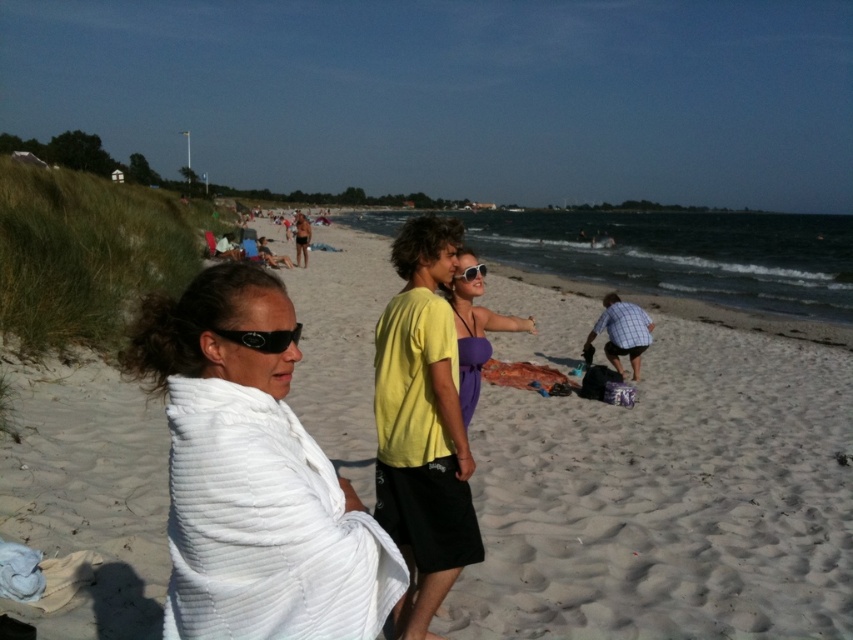
Does yellow cotton t-shirt at center have a larger size compared to matte yellow shirt at center?

Actually, yellow cotton t-shirt at center might be smaller than matte yellow shirt at center.

In the scene shown: Can you confirm if yellow cotton t-shirt at center is positioned to the right of matte yellow shirt at center?

Correct, you'll find yellow cotton t-shirt at center to the right of matte yellow shirt at center.

Between point (392, 380) and point (294, 241), which one is positioned in front?

Point (392, 380)

Image resolution: width=853 pixels, height=640 pixels. I want to click on yellow cotton t-shirt at center, so click(422, 426).

The height and width of the screenshot is (640, 853). I want to click on yellow cotton t-shirt at center, so click(x=422, y=426).

Image resolution: width=853 pixels, height=640 pixels. What are the coordinates of `yellow cotton t-shirt at center` in the screenshot? It's located at (422, 426).

Can you confirm if checkered fabric shirt at lower right is bigger than matte yellow shirt at center?

Actually, checkered fabric shirt at lower right might be smaller than matte yellow shirt at center.

Based on the photo, who is positioned more to the left, checkered fabric shirt at lower right or matte yellow shirt at center?

Positioned to the left is matte yellow shirt at center.

You are a GUI agent. You are given a task and a screenshot of the screen. Output one action in this format:
    pyautogui.click(x=<x>, y=<y>)
    Task: Click on the checkered fabric shirt at lower right
    
    Given the screenshot: What is the action you would take?
    pyautogui.click(x=622, y=332)